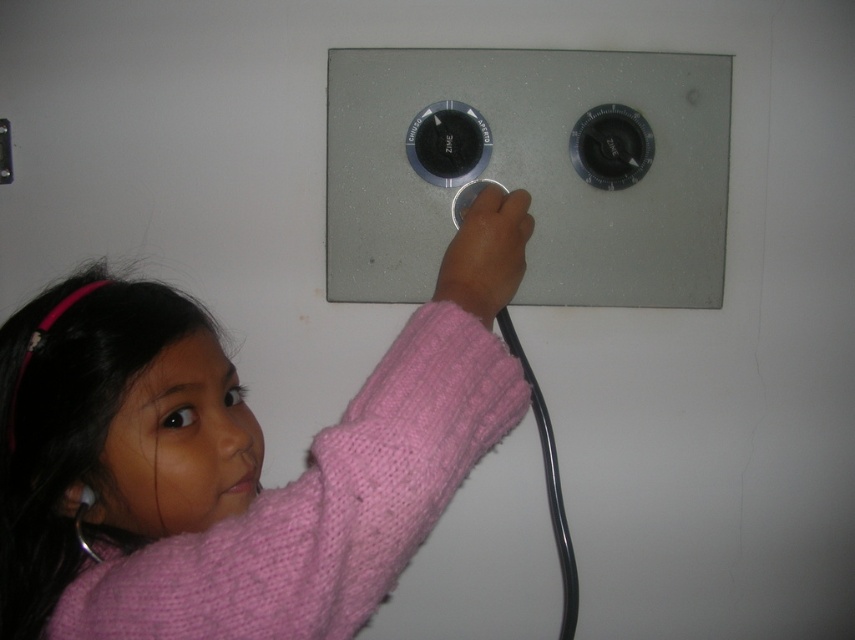
From the picture: Which of these two, black plastic knob at center or matte black knob at upper right, stands taller?

With more height is matte black knob at upper right.

Does black plastic knob at center have a greater width compared to matte black knob at upper right?

Correct, the width of black plastic knob at center exceeds that of matte black knob at upper right.

Measure the distance between black plastic knob at center and camera.

A distance of 35.71 inches exists between black plastic knob at center and camera.

Locate an element on the screen. black plastic knob at center is located at coordinates (447, 144).

Does satin silver knobs at center have a lesser width compared to matte pink sweater at center?

No, satin silver knobs at center is not thinner than matte pink sweater at center.

Is point (513, 129) closer to camera compared to point (514, 202)?

No, (513, 129) is further to viewer.

Find the location of `satin silver knobs at center`. satin silver knobs at center is located at coordinates (531, 170).

The height and width of the screenshot is (640, 855). Describe the element at coordinates (233, 458) in the screenshot. I see `pink knitted sweater at upper center` at that location.

Can you confirm if pink knitted sweater at upper center is positioned above matte black knob at center?

No, pink knitted sweater at upper center is not above matte black knob at center.

The image size is (855, 640). Describe the element at coordinates (233, 458) in the screenshot. I see `pink knitted sweater at upper center` at that location.

This screenshot has width=855, height=640. I want to click on pink knitted sweater at upper center, so click(233, 458).